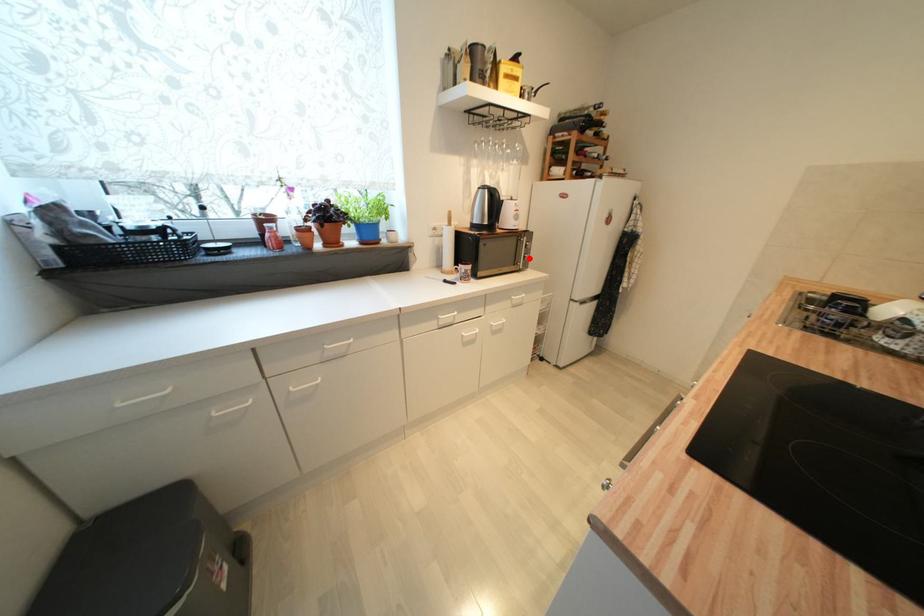
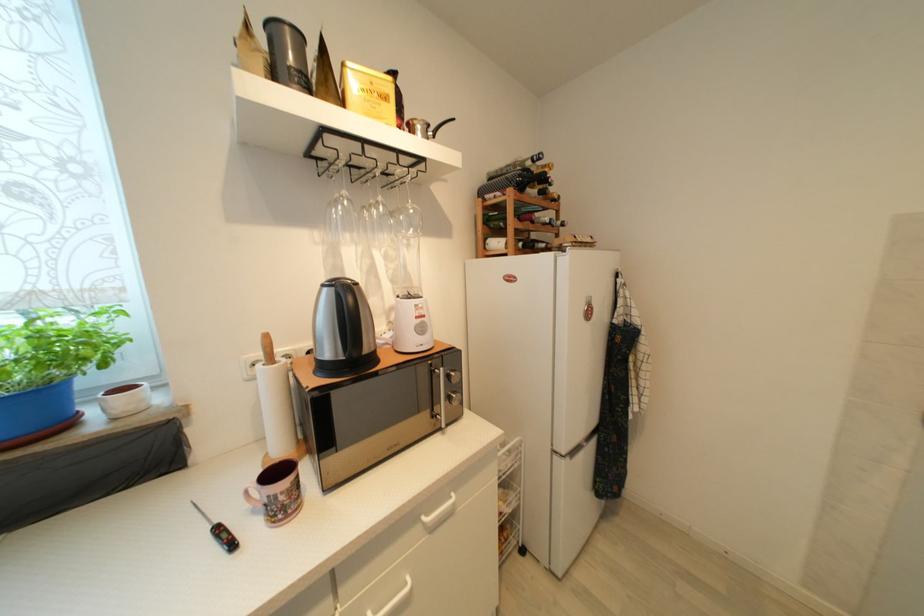
Question: I am providing you with two images of the same scene from different viewpoints. A red point is shown in image1. For the corresponding object point in image2, is it positioned nearer or farther from the camera?

Choices:
 (A) Nearer
 (B) Farther

Answer: (B)